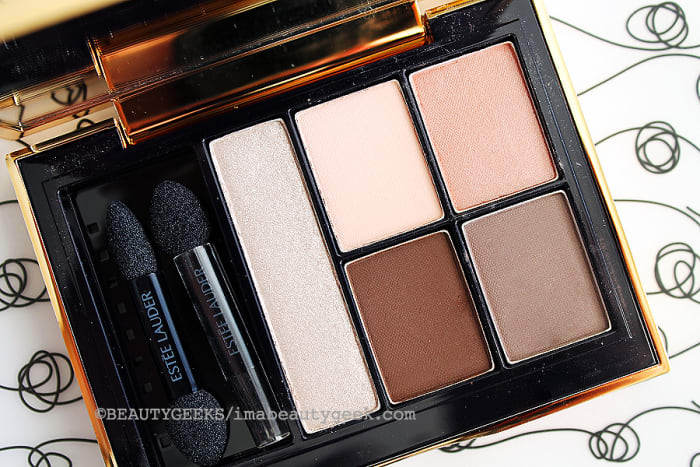
Image resolution: width=700 pixels, height=467 pixels. What are the coordinates of `black tray in case` in the screenshot? It's located at (84, 208).